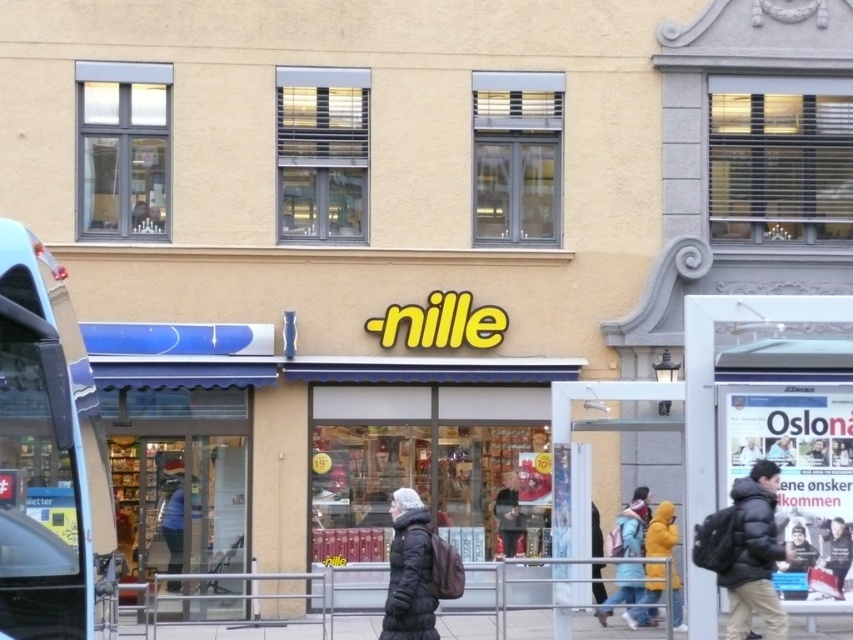
Does light blue jacket at center have a greater width compared to dark gray jacket at center?

Indeed, light blue jacket at center has a greater width compared to dark gray jacket at center.

Can you confirm if light blue jacket at center is shorter than dark gray jacket at center?

In fact, light blue jacket at center may be taller than dark gray jacket at center.

Identify the location of light blue jacket at center. Image resolution: width=853 pixels, height=640 pixels. (630, 525).

Does white plastic bus stop at lower right have a larger size compared to black matte jacket at lower right?

Yes, white plastic bus stop at lower right is bigger than black matte jacket at lower right.

Is white plastic bus stop at lower right thinner than black matte jacket at lower right?

No.

Locate an element on the screen. Image resolution: width=853 pixels, height=640 pixels. white plastic bus stop at lower right is located at coordinates (712, 372).

Is gray concrete pavement at lower center further to the viewer compared to dark gray jacket at center?

No, it is not.

At what (x,y) coordinates should I click in order to perform the action: click on gray concrete pavement at lower center. Please return your answer as a coordinate pair (x, y). Image resolution: width=853 pixels, height=640 pixels. Looking at the image, I should click on (238, 632).